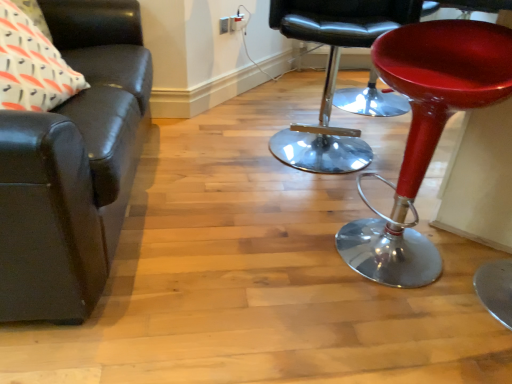
Question: Considering the relative sizes of matte black leather couch at left, which is the second chair from right to left, and white printed fabric pillow at upper left in the image provided, is matte black leather couch at left, which is the second chair from right to left, wider than white printed fabric pillow at upper left?

Choices:
 (A) no
 (B) yes

Answer: (B)

Question: From the image's perspective, does matte black leather couch at left, which is the second chair from right to left, appear lower than white printed fabric pillow at upper left?

Choices:
 (A) no
 (B) yes

Answer: (B)

Question: Are matte black leather couch at left, which is counted as the 1th chair, starting from the left, and white printed fabric pillow at upper left located far from each other?

Choices:
 (A) no
 (B) yes

Answer: (A)

Question: Does matte black leather couch at left, which is the second chair from right to left, appear on the left side of white printed fabric pillow at upper left?

Choices:
 (A) no
 (B) yes

Answer: (A)

Question: Is matte black leather couch at left, which is the second chair from right to left, surrounding white printed fabric pillow at upper left?

Choices:
 (A) yes
 (B) no

Answer: (A)

Question: Is the position of matte black leather couch at left, which is counted as the 1th chair, starting from the left, more distant than that of white printed fabric pillow at upper left?

Choices:
 (A) yes
 (B) no

Answer: (B)

Question: Does shiny red stool at right have a lesser width compared to matte black leather couch at left, which is counted as the 1th chair, starting from the left?

Choices:
 (A) yes
 (B) no

Answer: (A)

Question: Considering the relative positions of shiny red stool at right and matte black leather couch at left, which is counted as the 1th chair, starting from the left, in the image provided, is shiny red stool at right to the right of matte black leather couch at left, which is counted as the 1th chair, starting from the left, from the viewer's perspective?

Choices:
 (A) no
 (B) yes

Answer: (B)

Question: From the image's perspective, is shiny red stool at right on top of matte black leather couch at left, which is counted as the 1th chair, starting from the left?

Choices:
 (A) yes
 (B) no

Answer: (A)

Question: Is shiny red stool at right further to the viewer compared to matte black leather couch at left, which is the second chair from right to left?

Choices:
 (A) no
 (B) yes

Answer: (B)

Question: Is shiny red stool at right wider than matte black leather couch at left, which is the second chair from right to left?

Choices:
 (A) no
 (B) yes

Answer: (A)

Question: Can you confirm if shiny red stool at right is bigger than matte black leather couch at left, which is the second chair from right to left?

Choices:
 (A) no
 (B) yes

Answer: (A)

Question: From the image's perspective, is shiny red stool at right located above shiny chrome stool at center, marked as the 1th chair in a right-to-left arrangement?

Choices:
 (A) yes
 (B) no

Answer: (B)